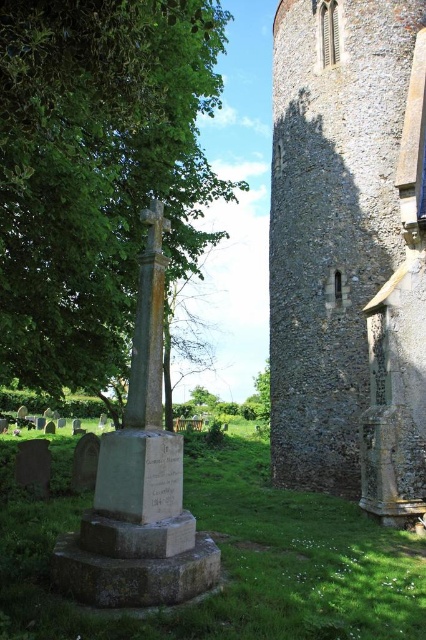
Does point (399, 189) lie behind point (97, 344)?

No.

Does gray stone tower at right have a greater height compared to green leafy tree at center?

Indeed, gray stone tower at right has a greater height compared to green leafy tree at center.

Does point (348, 192) come farther from viewer compared to point (106, 134)?

Yes, point (348, 192) is behind point (106, 134).

Locate an element on the screen. This screenshot has width=426, height=640. gray stone tower at right is located at coordinates (350, 252).